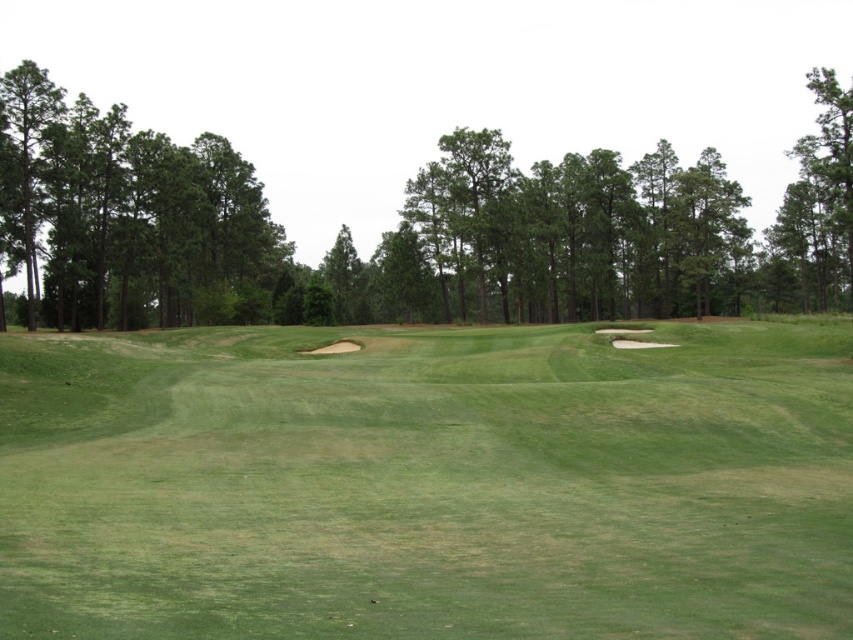
Consider the image. Does green grassy fairway at center have a larger size compared to green leafy trees at center?

No.

What do you see at coordinates (427, 483) in the screenshot? The height and width of the screenshot is (640, 853). I see `green grassy fairway at center` at bounding box center [427, 483].

I want to click on green grassy fairway at center, so click(427, 483).

Does point (0, 157) come in front of point (94, 218)?

Yes, it is.

Is green leafy trees at center to the left of green leafy trees at left from the viewer's perspective?

In fact, green leafy trees at center is to the right of green leafy trees at left.

Is point (604, 179) positioned in front of point (26, 81)?

No, (604, 179) is behind (26, 81).

This screenshot has height=640, width=853. Find the location of `green leafy trees at center`. green leafy trees at center is located at coordinates (404, 228).

This screenshot has height=640, width=853. Identify the location of green grassy fairway at center. (427, 483).

Does point (219, 556) come behind point (131, 195)?

No, it is in front of (131, 195).

What are the coordinates of `green grassy fairway at center` in the screenshot? It's located at (427, 483).